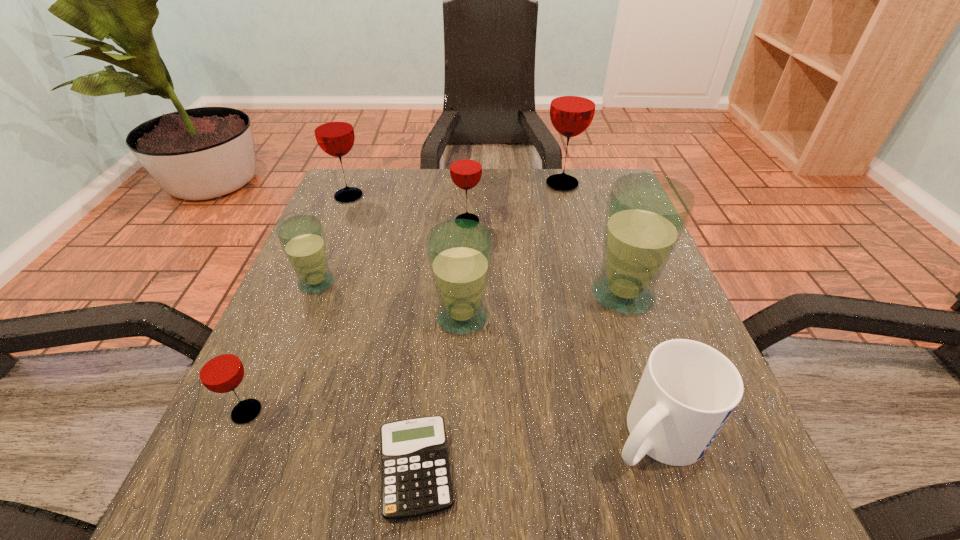
The height and width of the screenshot is (540, 960). Identify the location of object that stands as the second closest to the biggest blue glass. (459, 251).

Locate an element on the screen. The width and height of the screenshot is (960, 540). the third closest object to the smallest blue glass is located at coordinates (333, 129).

What are the coordinates of `glass that is the closest to the nearest red glass` in the screenshot? It's located at (302, 238).

At what (x,y) coordinates should I click in order to perform the action: click on glass that is the closest to the nearest red glass. Please return your answer as a coordinate pair (x, y). The height and width of the screenshot is (540, 960). Looking at the image, I should click on (302, 238).

Choose which red glass is the nearest neighbor to the blue mug. Please provide its 2D coordinates. Your answer should be formatted as a tuple, i.e. [(x, y)], where the tuple contains the x and y coordinates of a point satisfying the conditions above.

[(465, 168)]

Identify which red glass is the third nearest to the second biggest red glass. Please provide its 2D coordinates. Your answer should be formatted as a tuple, i.e. [(x, y)], where the tuple contains the x and y coordinates of a point satisfying the conditions above.

[(220, 370)]

In order to click on the third closest blue glass to the shortest object in this screenshot , I will do `click(646, 215)`.

Identify which blue glass is the nearest to the shortest object. Please provide its 2D coordinates. Your answer should be formatted as a tuple, i.e. [(x, y)], where the tuple contains the x and y coordinates of a point satisfying the conditions above.

[(459, 251)]

Find the location of a particular element. The width and height of the screenshot is (960, 540). free space that satisfies the following two spatial constraints: 1. on the back side of the smallest red glass; 2. on the left side of the second biggest red glass is located at coordinates (341, 196).